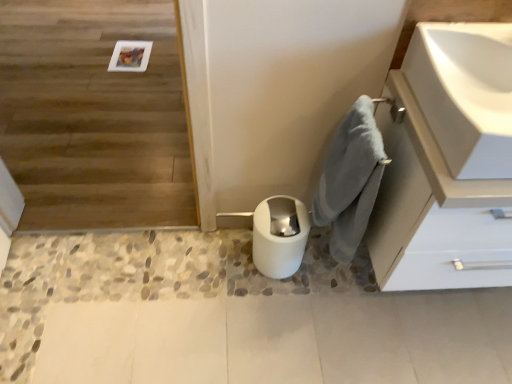
Where is `free space underneath white matte cabinet at upper right (from a real-world perspective)`? This screenshot has width=512, height=384. free space underneath white matte cabinet at upper right (from a real-world perspective) is located at coordinates (444, 303).